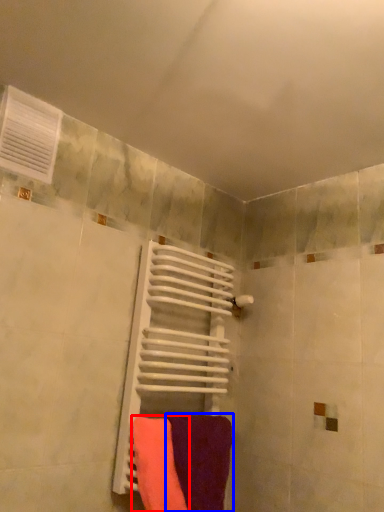
Question: Which object is closer to the camera taking this photo, towel (highlighted by a red box) or towel (highlighted by a blue box)?

Choices:
 (A) towel
 (B) towel

Answer: (A)